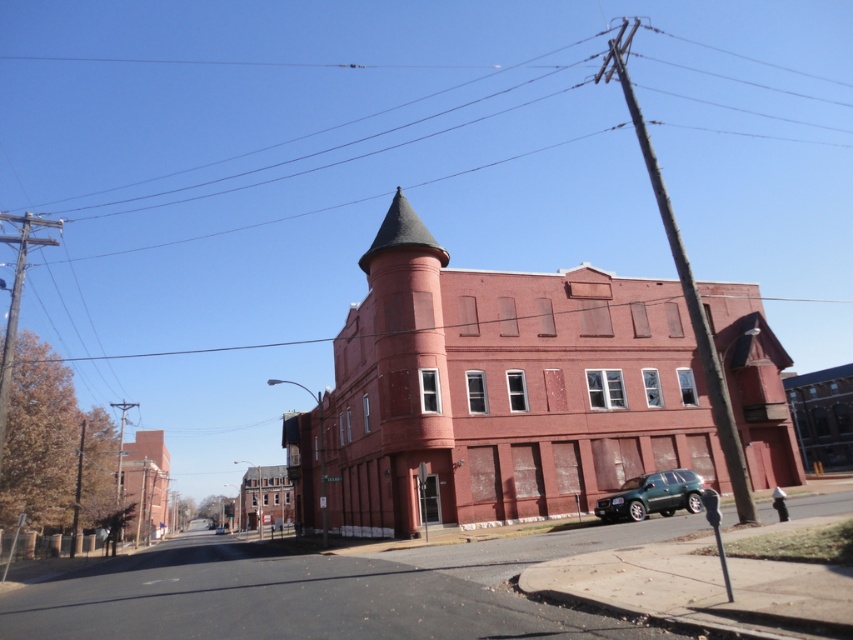
Consider the image. You are standing on the sidewalk in front of the red brick building. You see a point marked at coordinates (653,496). What object is located at that point?

The green matte SUV at lower right is located at point (653,496).

You are standing at the point marked as point (x=601, y=518) in front of the red brick building with a conical tower. You want to take a photo of the building from a distance of exactly 67.83 feet. Is your current position correct?

Yes, your current position at point (x=601, y=518) is exactly 67.83 feet away from the camera, so you are at the correct distance to take the photo.

You are a pedestrian standing on the sidewalk in front of the red brick building. You see two green SUVs nearby. Which one is closer to the building? The green matte suv at lower right or the green metallic suv at center?

The green metallic suv at center is closer to the building because it is positioned at the center, while the green matte suv at lower right is further to the right.